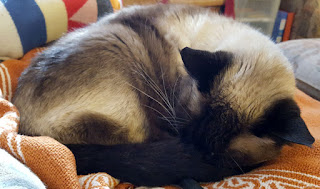
The height and width of the screenshot is (189, 320). I want to click on books, so click(x=277, y=30), click(x=287, y=30).